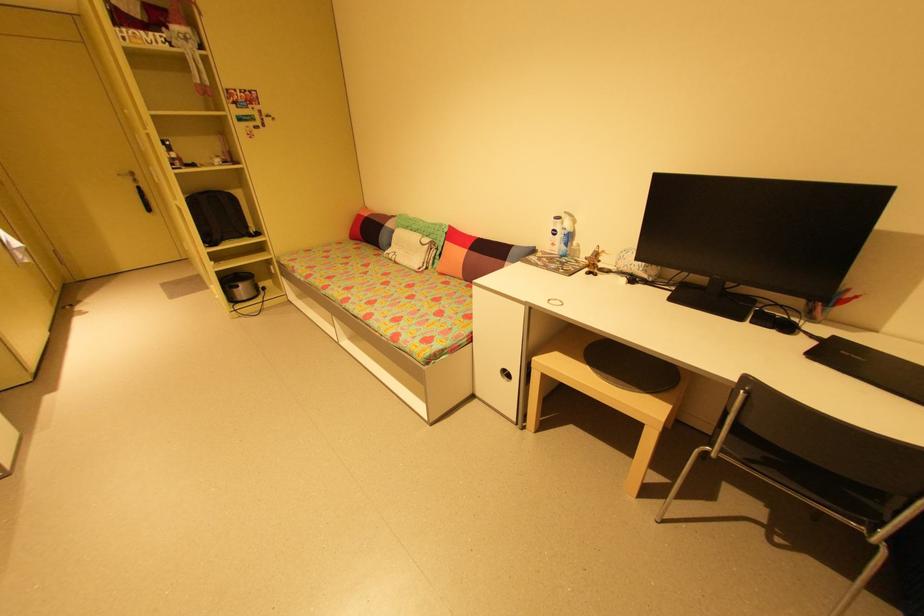
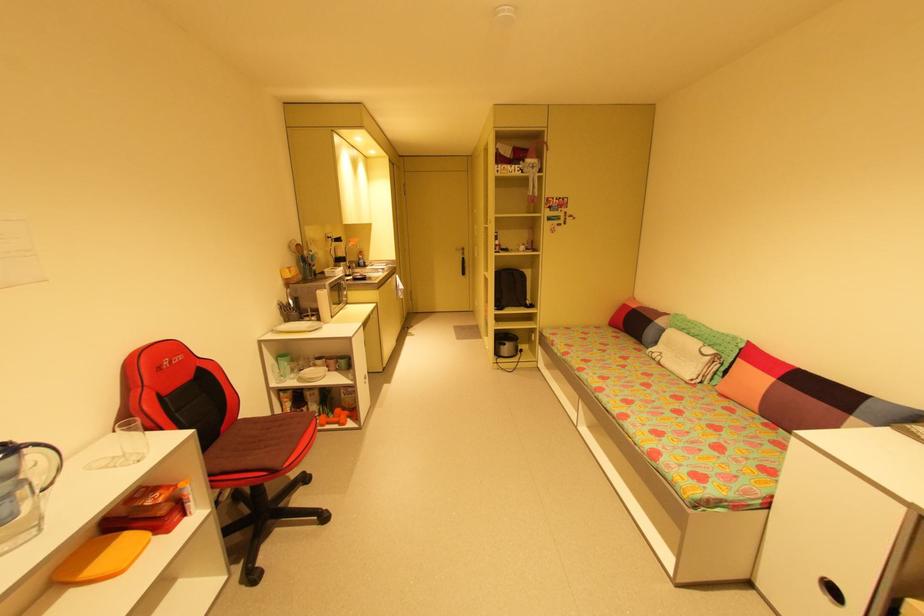
Question: The camera is either moving clockwise (left) or counter-clockwise (right) around the object. The first image is from the beginning of the video and the second image is from the end. Is the camera moving left or right when shooting the video?

Choices:
 (A) Left
 (B) Right

Answer: (B)